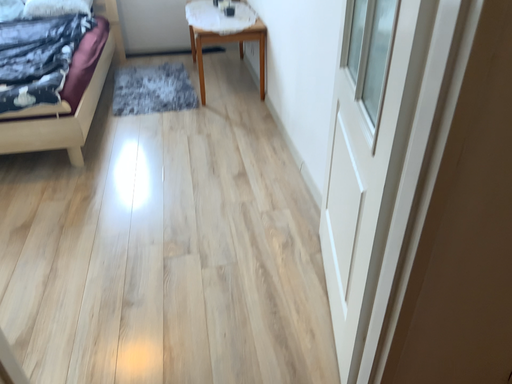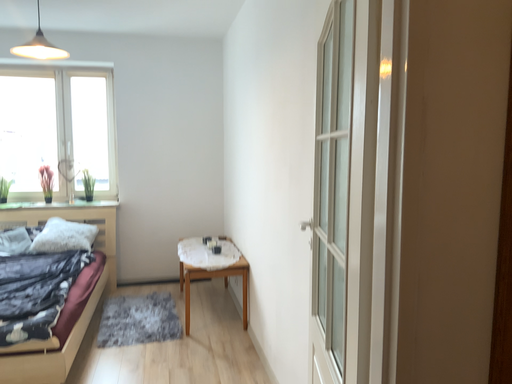
Question: How did the camera likely rotate when shooting the video?

Choices:
 (A) rotated upward
 (B) rotated downward

Answer: (A)